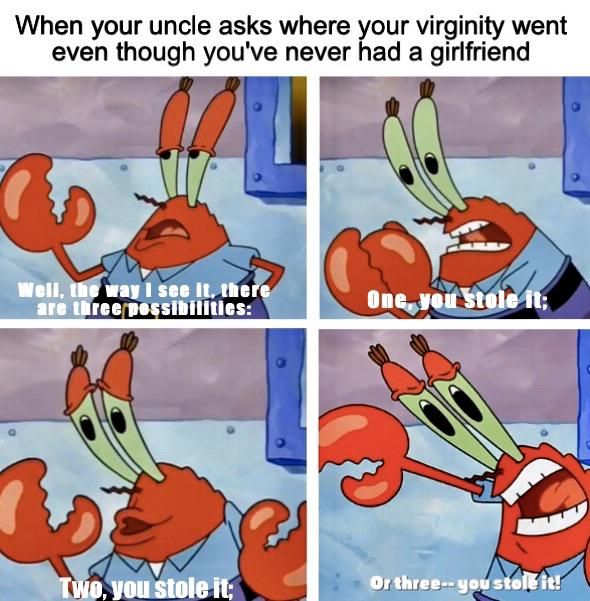
In order to click on door in this screenshot , I will do `click(263, 123)`, `click(284, 391)`, `click(585, 397)`, `click(576, 145)`.